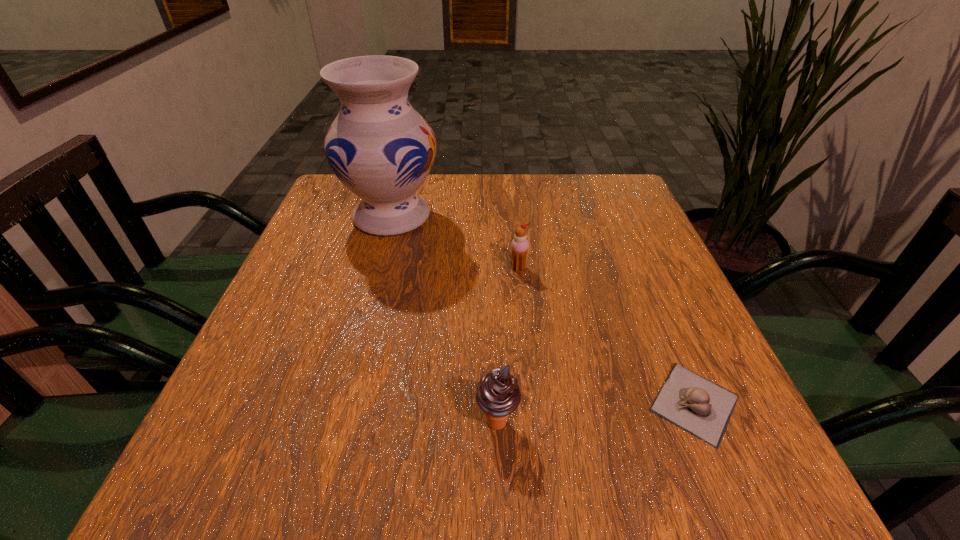
Where is `vacant space at the left edge of the desktop`? This screenshot has width=960, height=540. vacant space at the left edge of the desktop is located at coordinates (285, 381).

You are a GUI agent. You are given a task and a screenshot of the screen. Output one action in this format:
    pyautogui.click(x=<x>, y=<y>)
    Task: Click on the vacant space at the right edge of the desktop
    The height and width of the screenshot is (540, 960).
    Given the screenshot: What is the action you would take?
    pyautogui.click(x=668, y=293)

Find the location of `free space at the far left corner of the desktop`. free space at the far left corner of the desktop is located at coordinates (342, 207).

I want to click on free space at the far right corner of the desktop, so click(596, 181).

The image size is (960, 540). I want to click on free point between the farthest object and the shortest object, so click(543, 310).

Locate an element on the screen. Image resolution: width=960 pixels, height=540 pixels. vacant space that's between the farthest object and the shortest object is located at coordinates (543, 310).

Find the location of a particular element. vacant area that lies between the third object from right to left and the farthest object is located at coordinates (444, 319).

You are a GUI agent. You are given a task and a screenshot of the screen. Output one action in this format:
    pyautogui.click(x=<x>, y=<y>)
    Task: Click on the vacant region between the leftmost object and the left icecream
    The width and height of the screenshot is (960, 540).
    Given the screenshot: What is the action you would take?
    pyautogui.click(x=444, y=319)

The height and width of the screenshot is (540, 960). In order to click on vacant area that lies between the tallest object and the nearer icecream in this screenshot , I will do `click(444, 319)`.

Where is `empty space that is in between the vase and the third object from right to left`? empty space that is in between the vase and the third object from right to left is located at coordinates (444, 319).